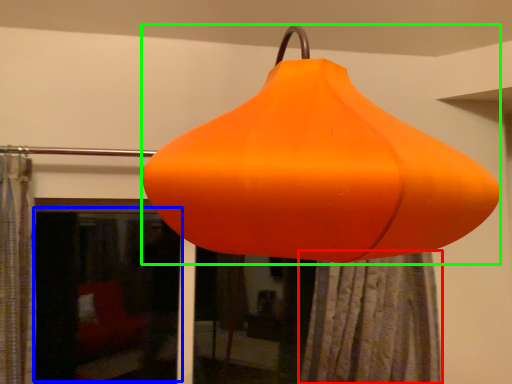
Question: Estimate the real-world distances between objects in this image. Which object is farther from shower curtain (highlighted by a red box), window screen (highlighted by a blue box) or lantern (highlighted by a green box)?

Choices:
 (A) window screen
 (B) lantern

Answer: (A)